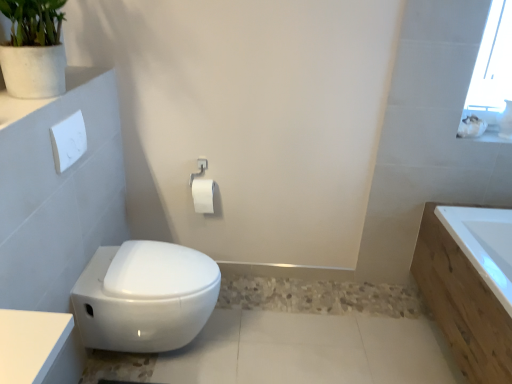
This screenshot has height=384, width=512. I want to click on free space to the right of white glossy bidet at lower left, so click(x=260, y=339).